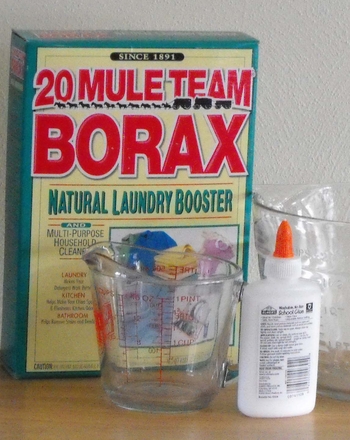
Image resolution: width=350 pixels, height=440 pixels. What are the coordinates of `table` in the screenshot? It's located at (68, 407).